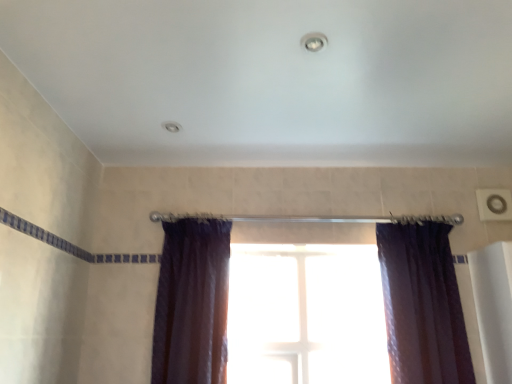
Question: Is satin purple curtain at right, the 1th curtain from the right, inside or outside of satin dark purple curtain at center, positioned as the 2th curtain in right-to-left order?

Choices:
 (A) inside
 (B) outside

Answer: (B)

Question: From a real-world perspective, is satin purple curtain at right, the 1th curtain from the right, above or below satin dark purple curtain at center, placed as the 1th curtain when sorted from left to right?

Choices:
 (A) below
 (B) above

Answer: (A)

Question: Based on their relative distances, which object is farther from the satin dark purple curtain at center, positioned as the 2th curtain in right-to-left order?

Choices:
 (A) transparent glass window at center
 (B) satin purple curtain at right, which is the second curtain in left-to-right order

Answer: (B)

Question: Considering the real-world distances, which object is farthest from the transparent glass window at center?

Choices:
 (A) satin purple curtain at right, the 1th curtain from the right
 (B) satin dark purple curtain at center, positioned as the 2th curtain in right-to-left order

Answer: (B)